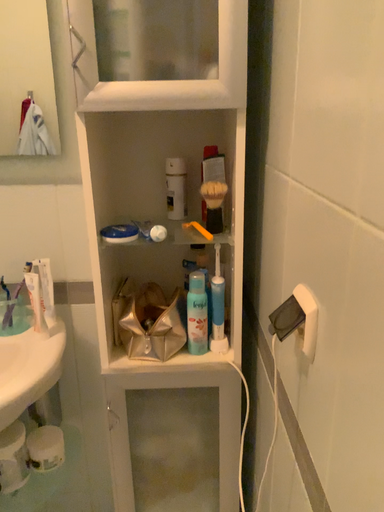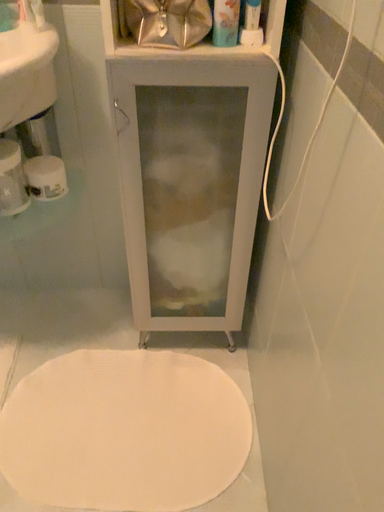
Question: How did the camera likely rotate when shooting the video?

Choices:
 (A) rotated upward
 (B) rotated downward

Answer: (B)